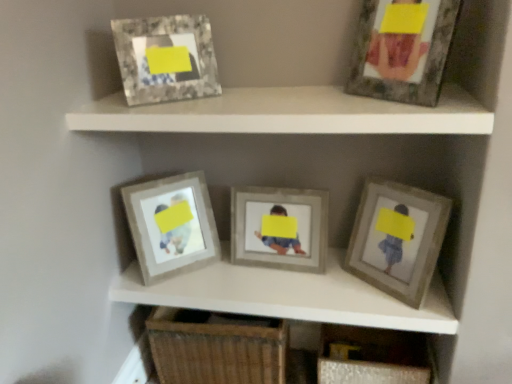
Question: Is there a large distance between matte gray frame at center and marble-like frame at upper left, positioned as the 4th picture frame in right-to-left order?

Choices:
 (A) no
 (B) yes

Answer: (A)

Question: Considering the relative sizes of matte gray frame at center and marble-like frame at upper left, positioned as the 4th picture frame in right-to-left order, in the image provided, is matte gray frame at center shorter than marble-like frame at upper left, positioned as the 4th picture frame in right-to-left order,?

Choices:
 (A) yes
 (B) no

Answer: (A)

Question: From the image's perspective, does matte gray frame at center appear higher than marble-like frame at upper left, the 2th picture frame viewed from the left?

Choices:
 (A) yes
 (B) no

Answer: (B)

Question: Can you confirm if matte gray frame at center is wider than marble-like frame at upper left, positioned as the 4th picture frame in right-to-left order?

Choices:
 (A) yes
 (B) no

Answer: (A)

Question: From a real-world perspective, is matte gray frame at center positioned under marble-like frame at upper left, the 2th picture frame viewed from the left, based on gravity?

Choices:
 (A) yes
 (B) no

Answer: (A)

Question: Could marble-like frame at upper left, the 2th picture frame viewed from the left, be considered to be inside matte gray frame at center?

Choices:
 (A) no
 (B) yes

Answer: (A)

Question: From the image's perspective, is matte gray frame at upper center above matte gray frame at center?

Choices:
 (A) yes
 (B) no

Answer: (A)

Question: Is matte gray frame at upper center closer to camera compared to matte gray frame at center?

Choices:
 (A) yes
 (B) no

Answer: (A)

Question: From a real-world perspective, is matte gray frame at upper center on matte gray frame at center?

Choices:
 (A) no
 (B) yes

Answer: (B)

Question: Can you confirm if matte gray frame at upper center is bigger than matte gray frame at center?

Choices:
 (A) no
 (B) yes

Answer: (A)

Question: Can you confirm if matte gray frame at upper center is wider than matte gray frame at center?

Choices:
 (A) yes
 (B) no

Answer: (B)

Question: Does matte gray frame at upper center have a lesser height compared to matte gray frame at center?

Choices:
 (A) yes
 (B) no

Answer: (B)

Question: Does matte gray frame at upper right, which ranks as the 2th picture frame in right-to-left order, have a smaller size compared to woven wood drawer at lower center?

Choices:
 (A) yes
 (B) no

Answer: (A)